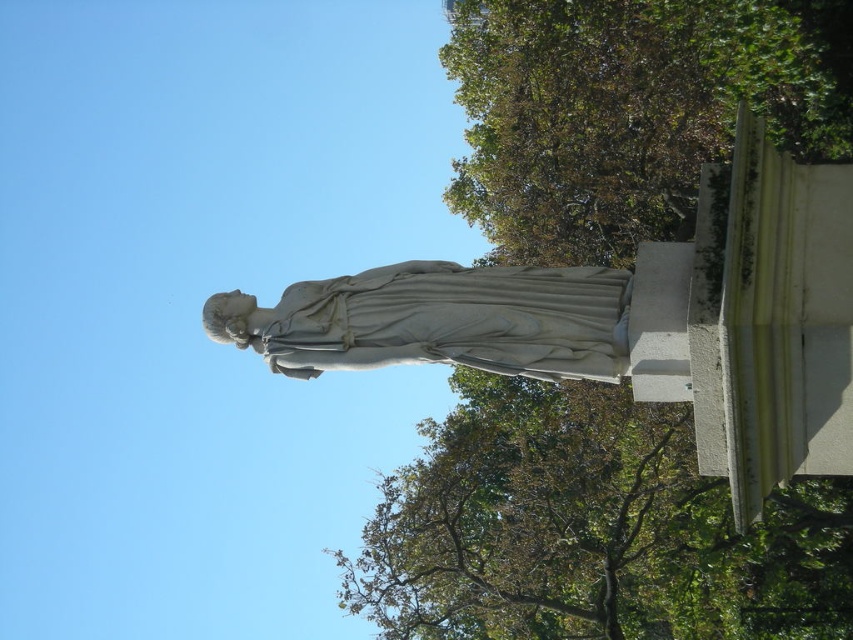
Question: Which point is closer to the camera taking this photo?

Choices:
 (A) (778, 81)
 (B) (561, 369)

Answer: (B)

Question: Does green leafy tree at lower center have a greater width compared to green leafy tree at upper right?

Choices:
 (A) no
 (B) yes

Answer: (B)

Question: Is green leafy tree at upper right bigger than white marble statue at center?

Choices:
 (A) yes
 (B) no

Answer: (A)

Question: Which point appears closest to the camera in this image?

Choices:
 (A) (811, 97)
 (B) (677, 600)

Answer: (A)

Question: Is green leafy tree at lower center to the left of white marble statue at center from the viewer's perspective?

Choices:
 (A) no
 (B) yes

Answer: (A)

Question: Which point appears farthest from the camera in this image?

Choices:
 (A) (813, 3)
 (B) (625, 328)

Answer: (A)